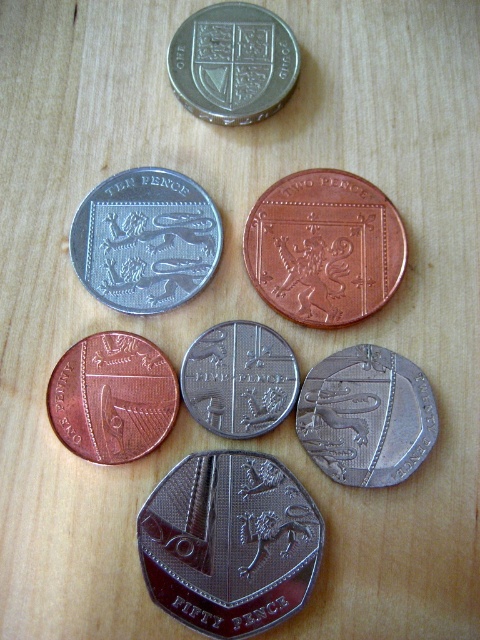
You are standing at the origin point of the coordinate system where the coins are arranged. Which object is located at the point with coordinates closest to (x=229, y=541)?

The shiny silver fifty pence at center is located at the point closest to (x=229, y=541).

You are a coin collector examining the coins on the wooden surface. You notice the shiny silver fifty pence at center and the satin silver coin at center. Which of these two coins has a greater width?

The shiny silver fifty pence at center has a greater width than the satin silver coin at center according to the description.

You are organizing coins on a desk and see the shiny silver fifty pence at center and the satin silver coin at center. Which one is positioned to the right?

The satin silver coin at center is positioned to the right of the shiny silver fifty pence at center.